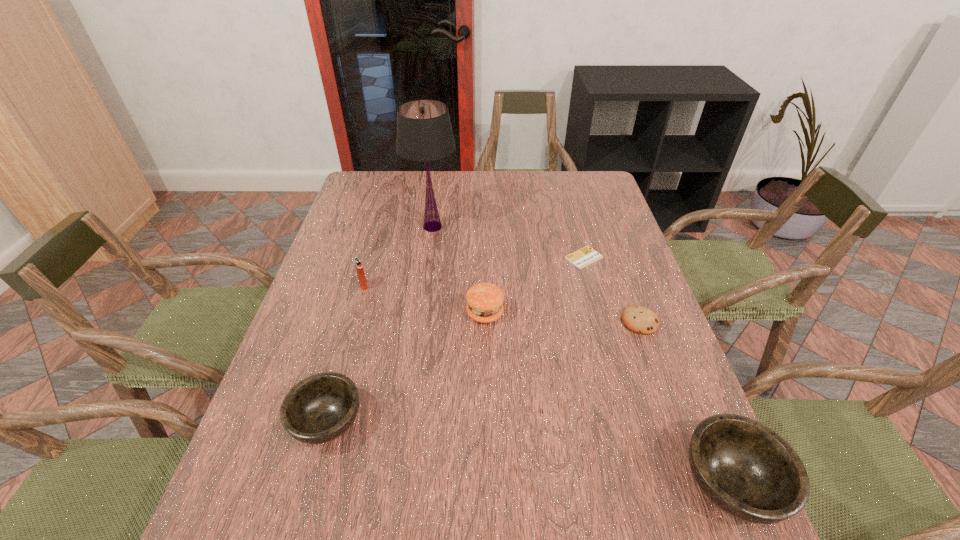
Identify the location of empty space that is in between the second farthest object and the fourth object from left to right. (535, 285).

Where is `vacant point located between the third farthest object and the second farthest object`? The width and height of the screenshot is (960, 540). vacant point located between the third farthest object and the second farthest object is located at coordinates (474, 272).

I want to click on free spot between the shorter bowl and the third object from left to right, so click(x=380, y=325).

The width and height of the screenshot is (960, 540). What are the coordinates of `empty space that is in between the right bowl and the third farthest object` in the screenshot? It's located at (547, 385).

The image size is (960, 540). Identify the location of vacant area that lies between the shortest object and the fifth object from right to left. (509, 242).

The height and width of the screenshot is (540, 960). I want to click on empty location between the fifth object from right to left and the third farthest object, so tap(398, 256).

Find the location of a particular element. free space between the patty and the identity card is located at coordinates (535, 285).

You are a GUI agent. You are given a task and a screenshot of the screen. Output one action in this format:
    pyautogui.click(x=<x>, y=<y>)
    Task: Click on the free space between the cookie and the fifth object from right to left
    
    Given the screenshot: What is the action you would take?
    pyautogui.click(x=537, y=274)

Where is `object that is the closest to the fourth object from left to right`? The image size is (960, 540). object that is the closest to the fourth object from left to right is located at coordinates (586, 255).

Identify which object is the second closest to the second farthest object. Please provide its 2D coordinates. Your answer should be formatted as a tuple, i.e. [(x, y)], where the tuple contains the x and y coordinates of a point satisfying the conditions above.

[(485, 300)]